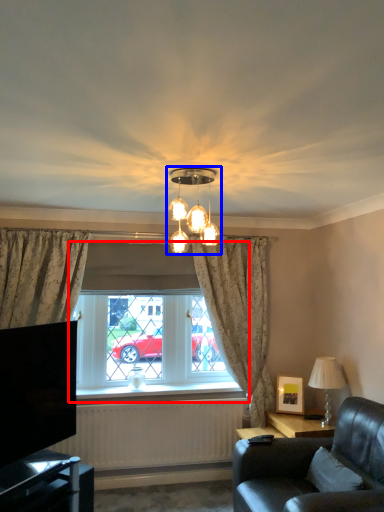
Question: Which object is closer to the camera taking this photo, window (highlighted by a red box) or lamp (highlighted by a blue box)?

Choices:
 (A) window
 (B) lamp

Answer: (B)